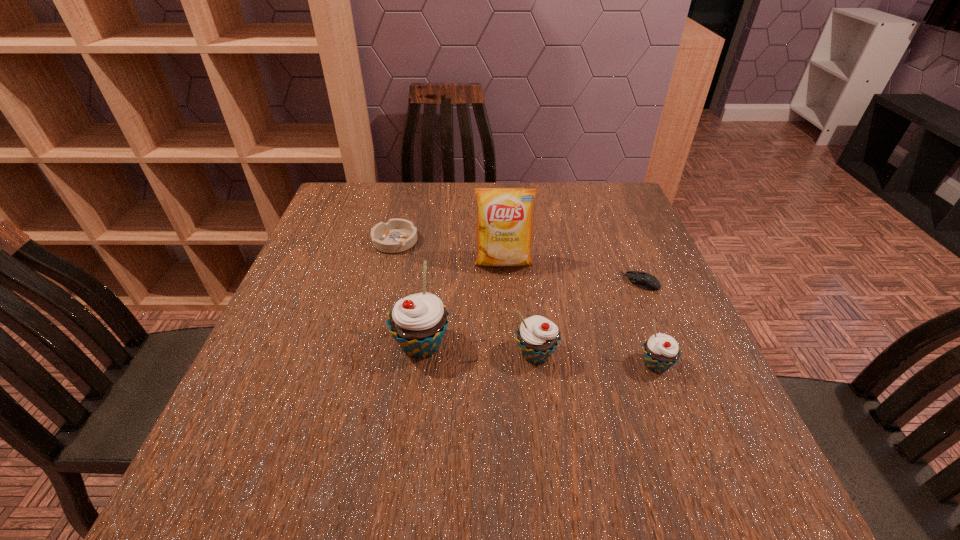
Where is `the tallest cupcake`? This screenshot has width=960, height=540. the tallest cupcake is located at coordinates (418, 322).

Locate an element on the screen. the third tallest object is located at coordinates (537, 337).

Identify the location of the second shortest cupcake. Image resolution: width=960 pixels, height=540 pixels. (537, 337).

In order to click on the shortest cupcake in this screenshot , I will do `click(661, 351)`.

In order to click on the rightmost cupcake in this screenshot , I will do `click(661, 351)`.

Find the location of `computer mouse`. computer mouse is located at coordinates (646, 281).

This screenshot has width=960, height=540. Identify the location of the second shortest object. (397, 235).

At what (x,y) coordinates should I click in order to perform the action: click on crisp (potato chip). Please return your answer as a coordinate pair (x, y). Looking at the image, I should click on (504, 232).

Where is `vacant space situated on the back of the leftmost cupcake`? This screenshot has height=540, width=960. vacant space situated on the back of the leftmost cupcake is located at coordinates (427, 300).

In order to click on vacant space located 0.260m on the right of the fourth shortest object in this screenshot , I will do `click(689, 355)`.